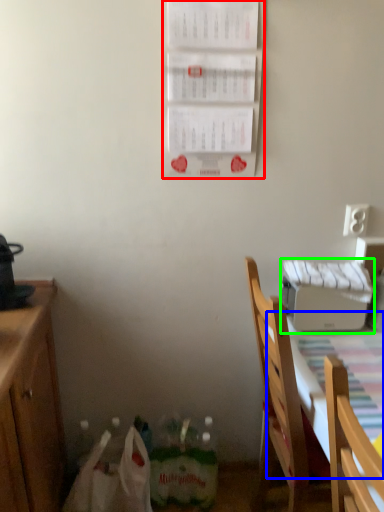
Question: Considering the real-world distances, which object is farthest from bulletin board (highlighted by a red box)? tablecloth (highlighted by a blue box) or appliance (highlighted by a green box)?

Choices:
 (A) tablecloth
 (B) appliance

Answer: (A)